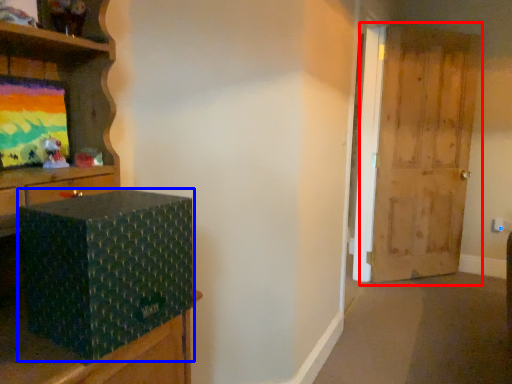
Question: Which of the following is the farthest to the observer, door (highlighted by a red box) or box (highlighted by a blue box)?

Choices:
 (A) door
 (B) box

Answer: (A)